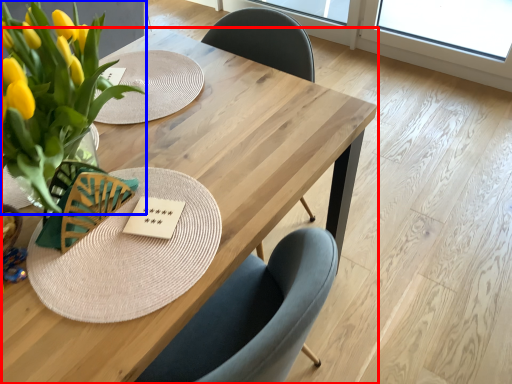
Question: Which object is further to the camera taking this photo, table (highlighted by a red box) or floral arrangement (highlighted by a blue box)?

Choices:
 (A) table
 (B) floral arrangement

Answer: (A)